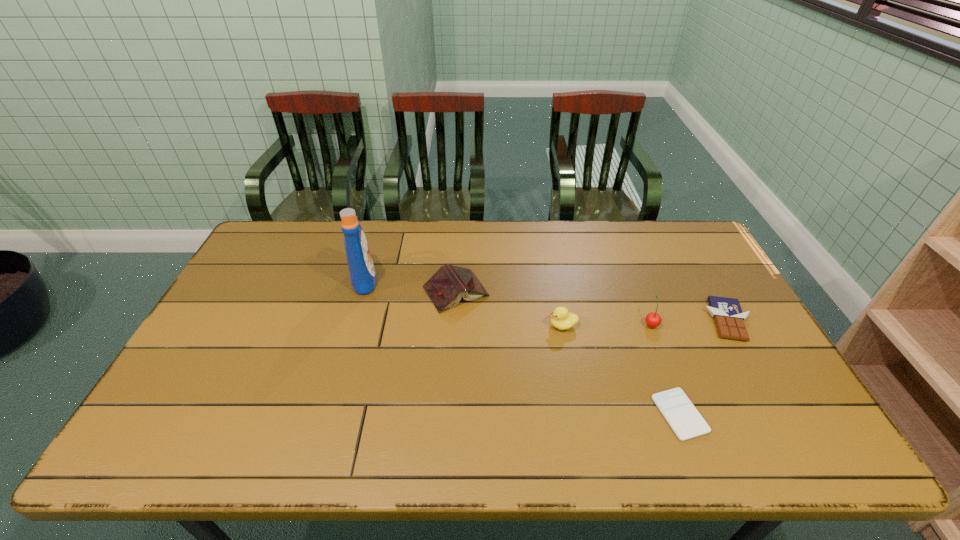
At what (x,y) coordinates should I click in order to perform the action: click on blank area in the image that satisfies the following two spatial constraints: 1. on the beak of the calculator; 2. on the left side of the fourth object from right to left. Please return your answer as a coordinate pair (x, y). Looking at the image, I should click on (579, 414).

You are a GUI agent. You are given a task and a screenshot of the screen. Output one action in this format:
    pyautogui.click(x=<x>, y=<y>)
    Task: Click on the free space that satisfies the following two spatial constraints: 1. on the label of the tallest object; 2. on the right side of the rightmost object
    
    Given the screenshot: What is the action you would take?
    pyautogui.click(x=352, y=320)

Locate an element on the screen. This screenshot has height=540, width=960. blank area in the image that satisfies the following two spatial constraints: 1. on the beak of the shortest object; 2. on the left side of the third object from left to right is located at coordinates (579, 414).

Locate an element on the screen. The image size is (960, 540). vacant space that satisfies the following two spatial constraints: 1. on the label of the detergent; 2. on the left side of the second tallest object is located at coordinates click(x=351, y=324).

This screenshot has height=540, width=960. Identify the location of free spot that satisfies the following two spatial constraints: 1. on the back side of the calculator; 2. on the label of the tallest object. (630, 280).

The width and height of the screenshot is (960, 540). I want to click on vacant area that satisfies the following two spatial constraints: 1. on the label of the fourth tallest object; 2. on the left side of the detergent, so click(361, 291).